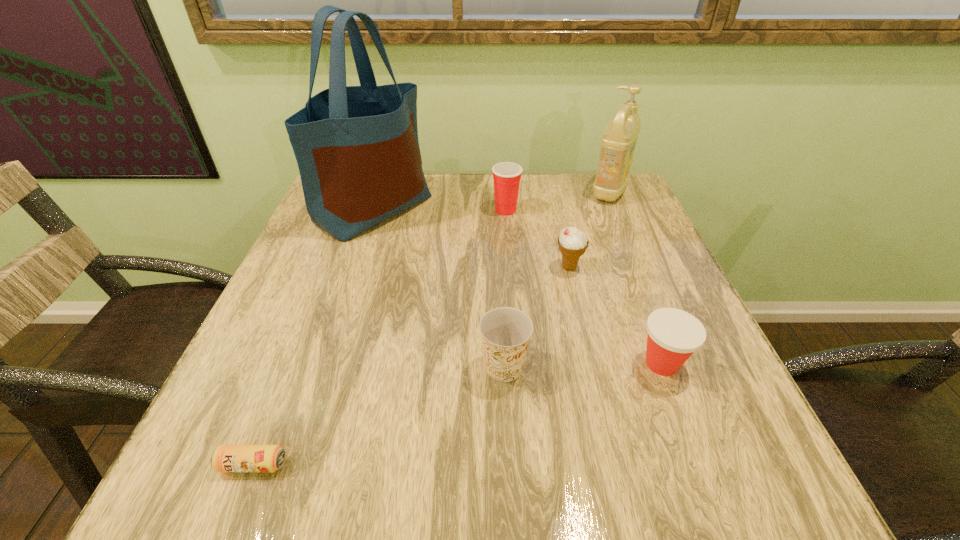
This screenshot has height=540, width=960. What are the coordinates of `vacant area that lies between the handbag and the farthest Dixie cup` in the screenshot? It's located at (440, 209).

Where is `empty space between the fourth nearest object and the sixth shortest object`? The image size is (960, 540). empty space between the fourth nearest object and the sixth shortest object is located at coordinates (589, 229).

Image resolution: width=960 pixels, height=540 pixels. In order to click on free area in between the rightmost Dixie cup and the handbag in this screenshot , I will do `click(517, 286)`.

Where is `free spot between the handbag and the beer can`? This screenshot has height=540, width=960. free spot between the handbag and the beer can is located at coordinates (314, 336).

This screenshot has height=540, width=960. I want to click on empty location between the nearest object and the farthest Dixie cup, so click(x=379, y=338).

Locate an element on the screen. This screenshot has width=960, height=540. unoccupied area between the rightmost Dixie cup and the nearest object is located at coordinates (457, 414).

At what (x,y) coordinates should I click in order to perform the action: click on unoccupied position between the handbag and the farthest Dixie cup. Please return your answer as a coordinate pair (x, y). Looking at the image, I should click on (440, 209).

Identify the location of object that stands as the sixth closest to the fourth nearest object. The width and height of the screenshot is (960, 540). (226, 458).

Where is `object that is the fourth closest to the second tallest object`? This screenshot has width=960, height=540. object that is the fourth closest to the second tallest object is located at coordinates (673, 335).

Identify the location of the closest Dixie cup to the detergent. (507, 175).